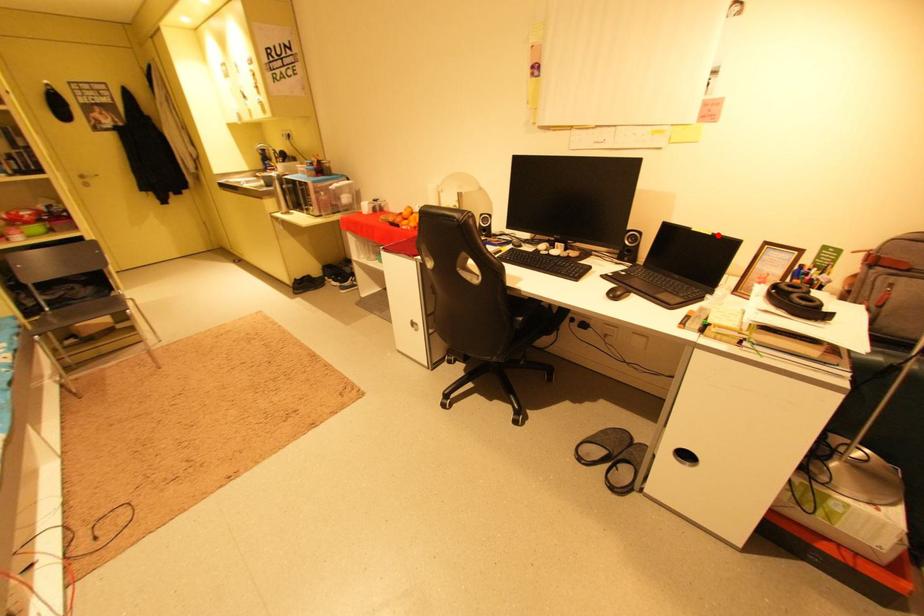
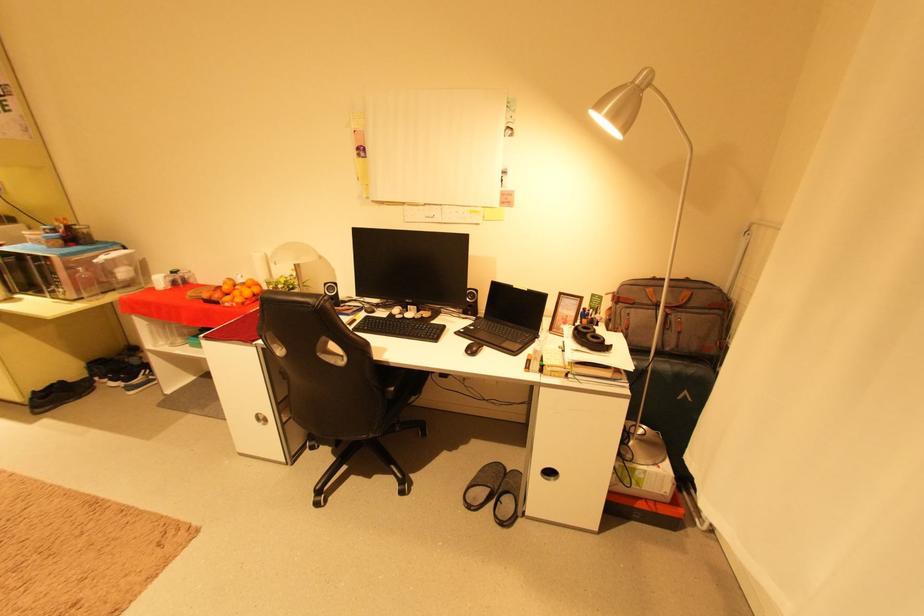
In the second image, find the point that corresponds to the highlighted location in the first image.

(533, 291)